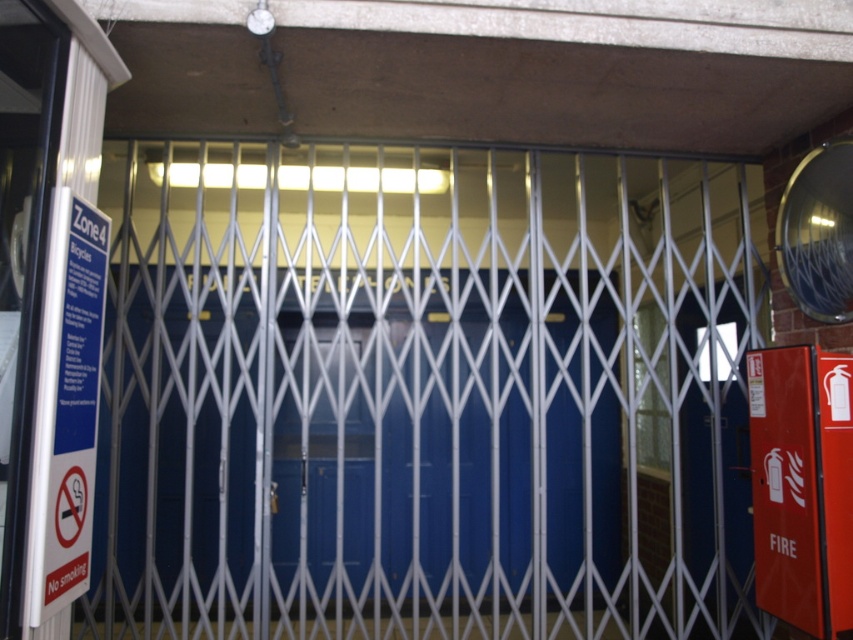
Can you confirm if metallic blue elevator at center is taller than red matte fire extinguisher at right?

Yes.

Measure the distance between metallic blue elevator at center and camera.

metallic blue elevator at center is 2.92 meters away from camera.

Find the location of a particular element. This screenshot has height=640, width=853. metallic blue elevator at center is located at coordinates (424, 396).